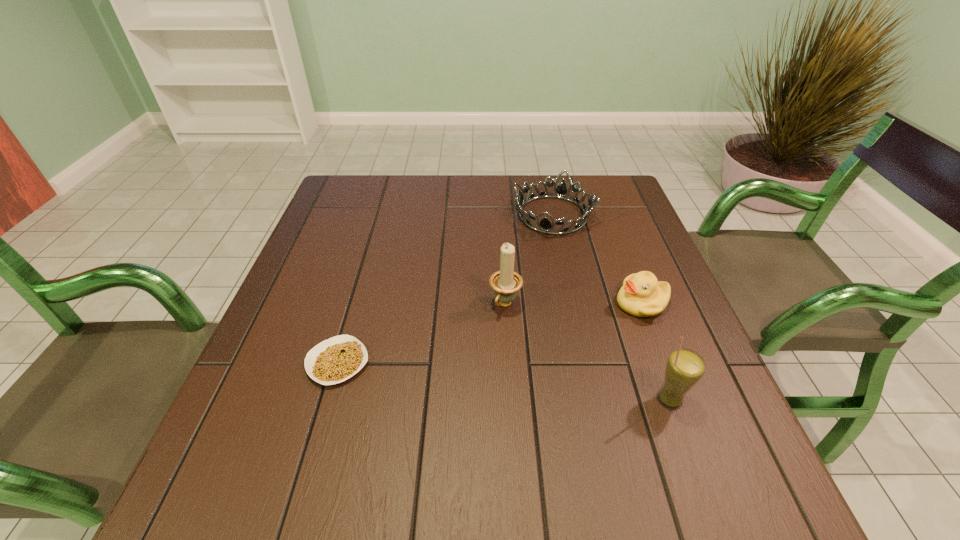
Find the location of a particular element. This screenshot has height=540, width=960. free space on the desktop that is between the legume and the straw for drinking and is positioned at the face of the duckling is located at coordinates (487, 379).

Identify the location of free space on the desktop that is between the shortest object and the straw for drinking and is positioned on the handle side of the candle_holder. The image size is (960, 540). (462, 376).

The image size is (960, 540). What are the coordinates of `free space on the desktop that is between the legume and the straw for drinking and is positioned on the front-facing side of the tiara` in the screenshot? It's located at (480, 378).